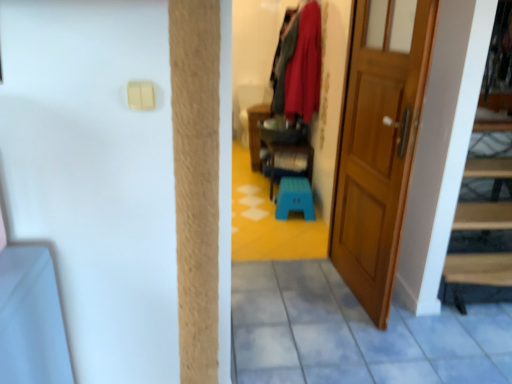
Question: Does point (236, 87) appear closer or farther from the camera than point (306, 142)?

Choices:
 (A) closer
 (B) farther

Answer: (B)

Question: Considering the positions of wooden armchair at center and teal plastic stool at center, placed as the second furniture when sorted from left to right, in the image, is wooden armchair at center wider or thinner than teal plastic stool at center, placed as the second furniture when sorted from left to right,?

Choices:
 (A) thin
 (B) wide

Answer: (B)

Question: Considering the real-world distances, which object is closest to the velvet red coat at upper center?

Choices:
 (A) wooden door at right
 (B) blue plastic step stool at center
 (C) teal plastic stool at center, marked as the 1th furniture in a right-to-left arrangement
 (D) wooden armchair at center
 (E) wooden cabinet at center, arranged as the 1th furniture when viewed from the left

Answer: (C)

Question: Based on their relative distances, which object is farther from the teal plastic stool at center, marked as the 1th furniture in a right-to-left arrangement?

Choices:
 (A) wooden armchair at center
 (B) blue plastic step stool at center
 (C) wooden door at right
 (D) wooden cabinet at center, arranged as the 1th furniture when viewed from the left
 (E) velvet red coat at upper center

Answer: (C)